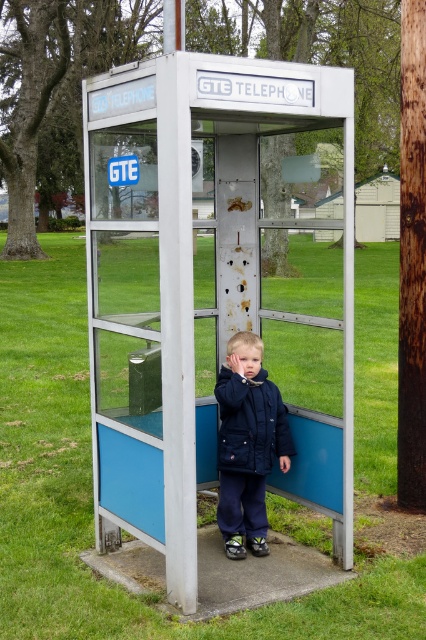
You are a parent trying to decide if your child can comfortably stand inside the metallic blue telephone booth at center while wearing the dark blue puffy coat at center. Based on the scene description, can the child fit inside the booth?

The metallic blue telephone booth at center is wider than the dark blue puffy coat at center, so the child should be able to fit comfortably inside the booth while wearing the coat.

You are a parent looking for your child in a park. You see the metallic blue telephone booth at center and the dark blue puffy coat at center. Which object is closer to you?

The dark blue puffy coat at center is closer to you because the metallic blue telephone booth at center is positioned over it, indicating the coat is beneath the booth.